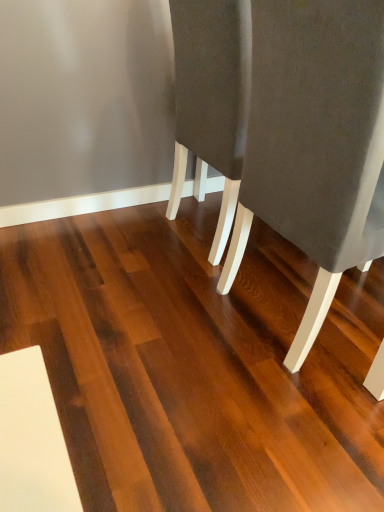
Question: In the image, is dark brown wood flooring at center on the left side or the right side of suede-like gray chair at right?

Choices:
 (A) left
 (B) right

Answer: (A)

Question: Is point (201, 239) positioned closer to the camera than point (289, 180)?

Choices:
 (A) farther
 (B) closer

Answer: (A)

Question: From a real-world perspective, is dark brown wood flooring at center above or below suede-like gray chair at right?

Choices:
 (A) below
 (B) above

Answer: (A)

Question: In terms of width, does suede-like gray chair at right look wider or thinner when compared to dark brown wood flooring at center?

Choices:
 (A) thin
 (B) wide

Answer: (A)

Question: Based on their sizes in the image, would you say suede-like gray chair at right is bigger or smaller than dark brown wood flooring at center?

Choices:
 (A) big
 (B) small

Answer: (A)

Question: Is point (306, 159) positioned closer to the camera than point (100, 315)?

Choices:
 (A) farther
 (B) closer

Answer: (B)

Question: Considering the positions of suede-like gray chair at right and dark brown wood flooring at center in the image, is suede-like gray chair at right taller or shorter than dark brown wood flooring at center?

Choices:
 (A) tall
 (B) short

Answer: (A)